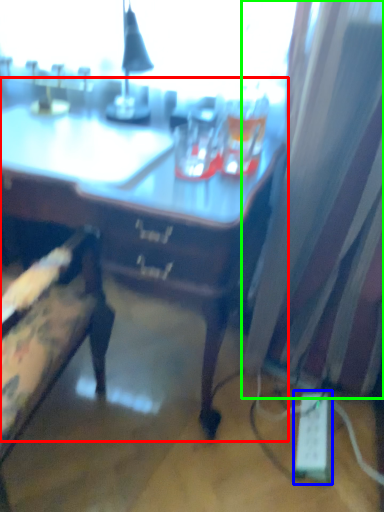
Question: Considering the real-world distances, which object is farthest from desk (highlighted by a red box)? extension cord (highlighted by a blue box) or curtain (highlighted by a green box)?

Choices:
 (A) extension cord
 (B) curtain

Answer: (A)